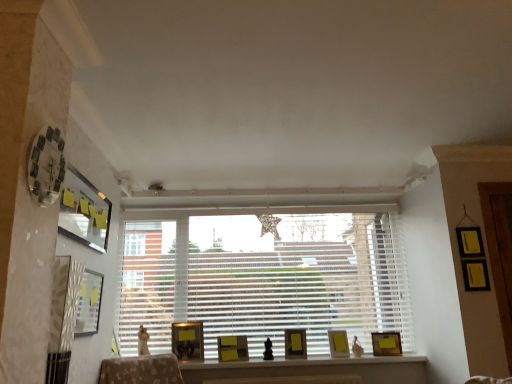
What do you see at coordinates (263, 278) in the screenshot? The width and height of the screenshot is (512, 384). I see `white blinds at center` at bounding box center [263, 278].

What do you see at coordinates (46, 165) in the screenshot? Image resolution: width=512 pixels, height=384 pixels. I see `clear glass clock at upper left, the 1th picture frame when ordered from front to back` at bounding box center [46, 165].

Measure the distance between matte wooden picture frame at center, arranged as the 3th picture frame when viewed from the front, and camera.

The distance of matte wooden picture frame at center, arranged as the 3th picture frame when viewed from the front, from camera is 10.69 feet.

Describe the element at coordinates (338, 344) in the screenshot. I see `matte yellow picture frame at center, positioned as the second picture frame in back-to-front order` at that location.

In order to face matte yellow picture frame at center, the 6th picture frame from the front, should I rotate leftwards or rightwards?

You should look right and rotate roughly 11.105 degrees.

Locate an element on the screen. Image resolution: width=512 pixels, height=384 pixels. matte gold picture frame at center, the 3th picture frame when ordered from right to left is located at coordinates (295, 344).

This screenshot has height=384, width=512. I want to click on white blinds at center, so click(x=263, y=278).

Considering the relative sizes of wooden matte picture frame at center, positioned as the 1th picture frame in back-to-front order, and matte yellow picture frame at center, the 6th picture frame from the front, in the image provided, is wooden matte picture frame at center, positioned as the 1th picture frame in back-to-front order, taller than matte yellow picture frame at center, the 6th picture frame from the front,?

No, wooden matte picture frame at center, positioned as the 1th picture frame in back-to-front order, is not taller than matte yellow picture frame at center, the 6th picture frame from the front.

Which object is wider, wooden matte picture frame at center, which appears as the seventh picture frame when viewed from the left, or matte yellow picture frame at center, the sixth picture frame in the left-to-right sequence?

Wider between the two is matte yellow picture frame at center, the sixth picture frame in the left-to-right sequence.

Does wooden matte picture frame at center, which appears as the seventh picture frame when viewed from the left, appear on the right side of matte yellow picture frame at center, the sixth picture frame in the left-to-right sequence?

Correct, you'll find wooden matte picture frame at center, which appears as the seventh picture frame when viewed from the left, to the right of matte yellow picture frame at center, the sixth picture frame in the left-to-right sequence.

How distant is wooden matte picture frame at center, the 7th picture frame positioned from the front, from matte yellow picture frame at center, the sixth picture frame in the left-to-right sequence?

wooden matte picture frame at center, the 7th picture frame positioned from the front, is 11.51 inches away from matte yellow picture frame at center, the sixth picture frame in the left-to-right sequence.

Measure the distance between matte black picture frame at upper left, which ranks as the first picture frame in left-to-right order, and matte yellow picture frame at center, the 6th picture frame from the front.

7.01 feet.

Does matte black picture frame at upper left, the 6th picture frame when ordered from back to front, lie in front of matte yellow picture frame at center, the sixth picture frame in the left-to-right sequence?

Yes.

From the image's perspective, is matte black picture frame at upper left, the seventh picture frame from the right, beneath matte yellow picture frame at center, marked as the second picture frame in a right-to-left arrangement?

Incorrect, from the image's perspective, matte black picture frame at upper left, the seventh picture frame from the right, is higher than matte yellow picture frame at center, marked as the second picture frame in a right-to-left arrangement.

Considering the positions of points (95, 224) and (342, 338), is point (95, 224) farther from camera compared to point (342, 338)?

No.

Which is in front, matte yellow picture frame at center, the sixth picture frame in the left-to-right sequence, or matte gold picture frame at center, the fifth picture frame in the front-to-back sequence?

matte gold picture frame at center, the fifth picture frame in the front-to-back sequence.

Is matte yellow picture frame at center, marked as the second picture frame in a right-to-left arrangement, looking in the opposite direction of matte gold picture frame at center, positioned as the 5th picture frame in left-to-right order?

That's not correct — matte yellow picture frame at center, marked as the second picture frame in a right-to-left arrangement, is not looking away from matte gold picture frame at center, positioned as the 5th picture frame in left-to-right order.

Which of these two, matte yellow picture frame at center, the sixth picture frame in the left-to-right sequence, or matte gold picture frame at center, the fifth picture frame in the front-to-back sequence, is bigger?

With larger size is matte gold picture frame at center, the fifth picture frame in the front-to-back sequence.

Who is taller, matte yellow picture frame at center, positioned as the second picture frame in back-to-front order, or matte gold picture frame at center, the 3th picture frame when ordered from right to left?

Standing taller between the two is matte gold picture frame at center, the 3th picture frame when ordered from right to left.

From a real-world perspective, is matte gold picture frame at center, which is counted as the third picture frame, starting from the back, located beneath wooden matte picture frame at center, arranged as the 1th picture frame when viewed from the right?

No.

In the image, is matte gold picture frame at center, the 3th picture frame when ordered from right to left, positioned in front of or behind wooden matte picture frame at center, which appears as the seventh picture frame when viewed from the left?

In the image, matte gold picture frame at center, the 3th picture frame when ordered from right to left, appears in front of wooden matte picture frame at center, which appears as the seventh picture frame when viewed from the left.

Which is behind, point (298, 358) or point (383, 348)?

Positioned behind is point (383, 348).

Starting from the wooden matte picture frame at center, which appears as the seventh picture frame when viewed from the left, which picture frame is the 2nd one to the left? Please provide its 2D coordinates.

[(295, 344)]

Starting from the matte yellow picture frame at center, placed as the 4th picture frame when sorted from front to back, which picture frame is the 2nd one to the right? Please provide its 2D coordinates.

[(338, 344)]

Between matte yellow picture frame at center, positioned as the second picture frame in back-to-front order, and matte yellow picture frame at center, which is the fourth picture frame from right to left, which one has smaller width?

matte yellow picture frame at center, positioned as the second picture frame in back-to-front order, is thinner.

Which of these two, matte yellow picture frame at center, the sixth picture frame in the left-to-right sequence, or matte yellow picture frame at center, positioned as the fourth picture frame in left-to-right order, is bigger?

matte yellow picture frame at center, positioned as the fourth picture frame in left-to-right order.

Is matte yellow picture frame at center, positioned as the second picture frame in back-to-front order, aimed at matte yellow picture frame at center, which is the fourth picture frame in back-to-front order?

No.

From the image's perspective, which one is positioned lower, matte yellow picture frame at center, positioned as the fourth picture frame in left-to-right order, or wooden matte picture frame at center, the 7th picture frame positioned from the front?

matte yellow picture frame at center, positioned as the fourth picture frame in left-to-right order, is shown below in the image.

How distant is matte yellow picture frame at center, which is the fourth picture frame from right to left, from wooden matte picture frame at center, which appears as the seventh picture frame when viewed from the left?

matte yellow picture frame at center, which is the fourth picture frame from right to left, is 1.13 meters from wooden matte picture frame at center, which appears as the seventh picture frame when viewed from the left.

Are matte yellow picture frame at center, positioned as the fourth picture frame in left-to-right order, and wooden matte picture frame at center, arranged as the 1th picture frame when viewed from the right, far apart?

Yes.

From a real-world perspective, relative to wooden matte picture frame at center, which appears as the seventh picture frame when viewed from the left, is matte yellow picture frame at center, which is the fourth picture frame in back-to-front order, vertically above or below?

matte yellow picture frame at center, which is the fourth picture frame in back-to-front order, is situated higher than wooden matte picture frame at center, which appears as the seventh picture frame when viewed from the left, in the real world.

From a real-world perspective, is white blinds at center below matte wooden picture frame at center, which is counted as the 5th picture frame, starting from the right?

No, from a real-world perspective, white blinds at center is not below matte wooden picture frame at center, which is counted as the 5th picture frame, starting from the right.

Considering the sizes of white blinds at center and matte wooden picture frame at center, which is counted as the 5th picture frame, starting from the right, in the image, is white blinds at center taller or shorter than matte wooden picture frame at center, which is counted as the 5th picture frame, starting from the right,?

Clearly, white blinds at center is taller compared to matte wooden picture frame at center, which is counted as the 5th picture frame, starting from the right.

Is the surface of white blinds at center in direct contact with matte wooden picture frame at center, which is counted as the fifth picture frame, starting from the back?

There is a gap between white blinds at center and matte wooden picture frame at center, which is counted as the fifth picture frame, starting from the back.

At what (x,y) coordinates should I click in order to perform the action: click on picture frame lying behind the matte yellow picture frame at center, the sixth picture frame in the left-to-right sequence. Please return your answer as a coordinate pair (x, y). This screenshot has height=384, width=512. Looking at the image, I should click on (386, 343).

Which picture frame is the 4th one when counting from the front of the matte yellow picture frame at center, marked as the second picture frame in a right-to-left arrangement? Please provide its 2D coordinates.

[(84, 211)]

Considering their positions, is matte wooden picture frame at center, which is counted as the fifth picture frame, starting from the back, positioned further to wooden matte picture frame at center, arranged as the 1th picture frame when viewed from the right, than matte yellow picture frame at center, marked as the second picture frame in a right-to-left arrangement?

The object further to wooden matte picture frame at center, arranged as the 1th picture frame when viewed from the right, is matte wooden picture frame at center, which is counted as the fifth picture frame, starting from the back.

From the image, which object appears to be nearer to clear glass clock at upper left, arranged as the seventh picture frame when viewed from the back, wooden matte picture frame at center, positioned as the 1th picture frame in back-to-front order, or matte wooden picture frame at center, which is counted as the fifth picture frame, starting from the back?

matte wooden picture frame at center, which is counted as the fifth picture frame, starting from the back.

From the image, which object appears to be farther from matte yellow picture frame at center, the 6th picture frame from the front, matte yellow picture frame at center, placed as the 4th picture frame when sorted from front to back, or white blinds at center?

white blinds at center is positioned further to the anchor matte yellow picture frame at center, the 6th picture frame from the front.

Looking at the image, which one is located closer to clear glass clock at upper left, arranged as the seventh picture frame when viewed from the back, matte wooden picture frame at center, which is counted as the 5th picture frame, starting from the right, or matte black picture frame at upper left, the seventh picture frame from the right?

matte black picture frame at upper left, the seventh picture frame from the right, lies closer to clear glass clock at upper left, arranged as the seventh picture frame when viewed from the back, than the other object.

Looking at the image, which one is located closer to matte black picture frame at upper left, the 6th picture frame when ordered from back to front, clear glass clock at upper left, the 1th picture frame when ordered from front to back, or matte gold picture frame at center, which is counted as the third picture frame, starting from the back?

Among the two, clear glass clock at upper left, the 1th picture frame when ordered from front to back, is located nearer to matte black picture frame at upper left, the 6th picture frame when ordered from back to front.

Which object lies nearer to the anchor point matte wooden picture frame at center, which is counted as the fifth picture frame, starting from the back, clear glass clock at upper left, which ranks as the 6th picture frame in right-to-left order, or wooden matte picture frame at center, positioned as the 1th picture frame in back-to-front order?

Among the two, wooden matte picture frame at center, positioned as the 1th picture frame in back-to-front order, is located nearer to matte wooden picture frame at center, which is counted as the fifth picture frame, starting from the back.

Considering their positions, is matte wooden picture frame at center, which is counted as the fifth picture frame, starting from the back, positioned closer to clear glass clock at upper left, the 1th picture frame when ordered from front to back, than wooden matte picture frame at center, arranged as the 1th picture frame when viewed from the right?

matte wooden picture frame at center, which is counted as the fifth picture frame, starting from the back, is positioned closer to the anchor clear glass clock at upper left, the 1th picture frame when ordered from front to back.

From the picture: Which object lies nearer to the anchor point matte black picture frame at upper left, which ranks as the second picture frame in front-to-back order, matte gold picture frame at center, positioned as the 5th picture frame in left-to-right order, or matte wooden picture frame at center, which is counted as the 3th picture frame, starting from the left?

Based on the image, matte wooden picture frame at center, which is counted as the 3th picture frame, starting from the left, appears to be nearer to matte black picture frame at upper left, which ranks as the second picture frame in front-to-back order.

Where is `window between matte yellow picture frame at center, positioned as the fourth picture frame in left-to-right order, and matte yellow picture frame at center, the sixth picture frame in the left-to-right sequence, in the horizontal direction`? The image size is (512, 384). window between matte yellow picture frame at center, positioned as the fourth picture frame in left-to-right order, and matte yellow picture frame at center, the sixth picture frame in the left-to-right sequence, in the horizontal direction is located at coordinates (263, 278).

Locate an element on the screen. window between matte wooden picture frame at center, which is counted as the 5th picture frame, starting from the right, and matte yellow picture frame at center, marked as the second picture frame in a right-to-left arrangement, in the horizontal direction is located at coordinates (263, 278).

Find the location of a particular element. Image resolution: width=512 pixels, height=384 pixels. window between matte wooden picture frame at center, arranged as the 3th picture frame when viewed from the front, and matte gold picture frame at center, positioned as the 5th picture frame in left-to-right order, in the horizontal direction is located at coordinates (263, 278).

Locate an element on the screen. The image size is (512, 384). window located between matte yellow picture frame at center, which is the fourth picture frame from right to left, and wooden matte picture frame at center, the 7th picture frame positioned from the front, in the left-right direction is located at coordinates (263, 278).